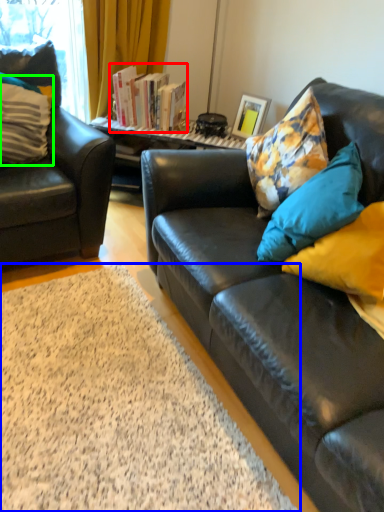
Question: Which is farther away from book (highlighted by a red box)? plain (highlighted by a blue box) or pillow (highlighted by a green box)?

Choices:
 (A) plain
 (B) pillow

Answer: (A)